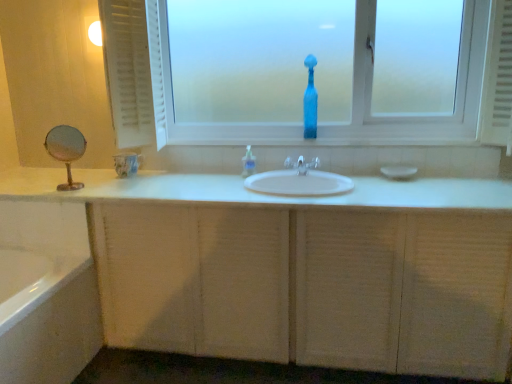
Locate an element on the screen. This screenshot has width=512, height=384. free region under transparent glass bottle at center (from a real-world perspective) is located at coordinates click(308, 139).